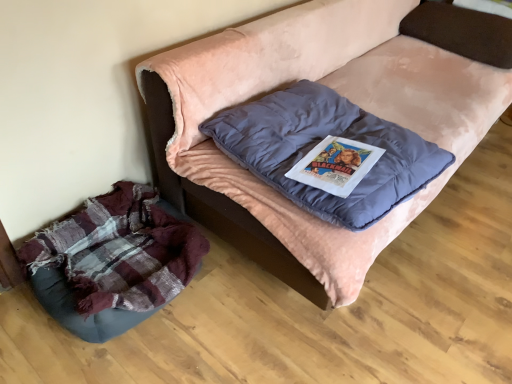
Question: Does velvet pink couch at center appear on the left side of plaid fabric dog bed at lower left?

Choices:
 (A) no
 (B) yes

Answer: (A)

Question: From the image's perspective, is velvet pink couch at center under plaid fabric dog bed at lower left?

Choices:
 (A) no
 (B) yes

Answer: (A)

Question: Would you consider velvet pink couch at center to be distant from plaid fabric dog bed at lower left?

Choices:
 (A) no
 (B) yes

Answer: (A)

Question: Does velvet pink couch at center come behind plaid fabric dog bed at lower left?

Choices:
 (A) yes
 (B) no

Answer: (B)

Question: From a real-world perspective, is velvet pink couch at center on top of plaid fabric dog bed at lower left?

Choices:
 (A) no
 (B) yes

Answer: (B)

Question: Looking at the image, does velvet pink couch at center seem bigger or smaller compared to plaid fabric dog bed at lower left?

Choices:
 (A) small
 (B) big

Answer: (B)

Question: Is velvet pink couch at center to the left or to the right of plaid fabric dog bed at lower left in the image?

Choices:
 (A) right
 (B) left

Answer: (A)

Question: In terms of width, does velvet pink couch at center look wider or thinner when compared to plaid fabric dog bed at lower left?

Choices:
 (A) wide
 (B) thin

Answer: (A)

Question: Relative to plaid fabric dog bed at lower left, is velvet pink couch at center in front or behind?

Choices:
 (A) behind
 (B) front

Answer: (B)

Question: From a real-world perspective, is velvet pink couch at center positioned above or below velvet blue pillow at upper right, which appears as the 1th pillow when viewed from the right?

Choices:
 (A) below
 (B) above

Answer: (A)

Question: Do you think velvet pink couch at center is within velvet blue pillow at upper right, which ranks as the second pillow in front-to-back order, or outside of it?

Choices:
 (A) outside
 (B) inside

Answer: (A)

Question: In the image, is velvet pink couch at center positioned in front of or behind velvet blue pillow at upper right, which is the second pillow in left-to-right order?

Choices:
 (A) behind
 (B) front

Answer: (B)

Question: In the image, is velvet pink couch at center on the left side or the right side of velvet blue pillow at upper right, the 1th pillow when ordered from top to bottom?

Choices:
 (A) left
 (B) right

Answer: (A)

Question: In terms of size, does velvet blue pillow at upper right, which is the second pillow in left-to-right order, appear bigger or smaller than plaid fabric dog bed at lower left?

Choices:
 (A) big
 (B) small

Answer: (B)

Question: From a real-world perspective, is velvet blue pillow at upper right, the 1th pillow when ordered from top to bottom, above or below plaid fabric dog bed at lower left?

Choices:
 (A) below
 (B) above

Answer: (B)